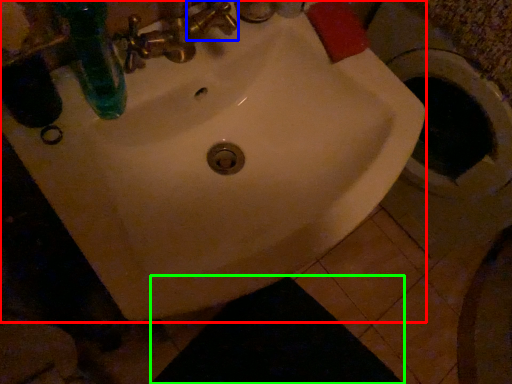
Question: Which object is the closest to the sink (highlighted by a red box)? Choose among these: plumbing fixture (highlighted by a blue box) or dark (highlighted by a green box).

Choices:
 (A) plumbing fixture
 (B) dark

Answer: (A)